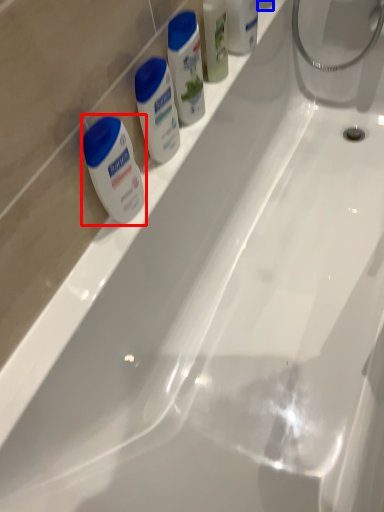
Question: Among these objects, which one is farthest to the camera, shaving cream (highlighted by a red box) or toiletry (highlighted by a blue box)?

Choices:
 (A) shaving cream
 (B) toiletry

Answer: (B)